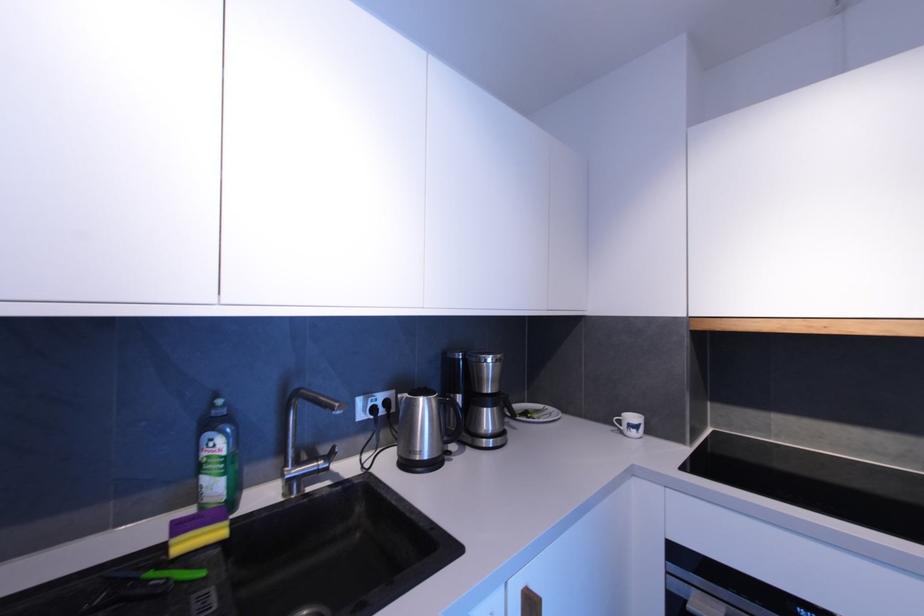
Image resolution: width=924 pixels, height=616 pixels. In order to click on kettle handle in this screenshot , I will do `click(451, 418)`.